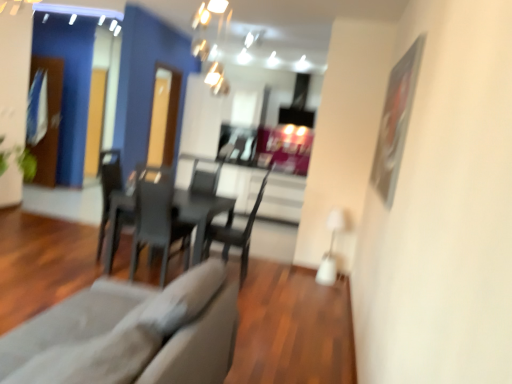
Identify the location of matte gray armchair at center, arranged as the first armchair when viewed from the left. Image resolution: width=512 pixels, height=384 pixels. (131, 204).

Where is `matte black chair at center, arranged as the 2th chair when viewed from the left`? Image resolution: width=512 pixels, height=384 pixels. matte black chair at center, arranged as the 2th chair when viewed from the left is located at coordinates (236, 234).

The width and height of the screenshot is (512, 384). What are the coordinates of `matte gray armchair at center, the second armchair positioned from the right` in the screenshot? It's located at (131, 204).

Based on their positions, is transparent glass door at center, which is counted as the 2th glass door, starting from the back, located to the left or right of gray fabric couch at lower left?

transparent glass door at center, which is counted as the 2th glass door, starting from the back, is to the left of gray fabric couch at lower left.

From the picture: From a real-world perspective, which is physically above, transparent glass door at center, marked as the first glass door in a right-to-left arrangement, or gray fabric couch at lower left?

transparent glass door at center, marked as the first glass door in a right-to-left arrangement, from a real-world perspective.

Which is closer to the camera, (156, 145) or (160, 326)?

The point (160, 326) is closer.

Which object is thinner, transparent glass door at center, positioned as the 2th glass door in left-to-right order, or gray fabric couch at lower left?

Thinner between the two is transparent glass door at center, positioned as the 2th glass door in left-to-right order.

Image resolution: width=512 pixels, height=384 pixels. Find the location of `glass door that is the 1st object located above the matte black chair at center, arranged as the 2th chair when viewed from the left (from the image's perspective)`. glass door that is the 1st object located above the matte black chair at center, arranged as the 2th chair when viewed from the left (from the image's perspective) is located at coordinates (164, 116).

Does point (177, 95) appear closer or farther from the camera than point (262, 196)?

Point (177, 95) is farther from the camera than point (262, 196).

From the image's perspective, is transparent glass door at center, arranged as the 1th glass door when viewed from the front, above or below matte black chair at center, arranged as the 1th chair when viewed from the right?

Based on their image positions, transparent glass door at center, arranged as the 1th glass door when viewed from the front, is located above matte black chair at center, arranged as the 1th chair when viewed from the right.

How different are the orientations of transparent glass door at center, which is counted as the 2th glass door, starting from the back, and matte black chair at center, arranged as the 1th chair when viewed from the right, in degrees?

The facing directions of transparent glass door at center, which is counted as the 2th glass door, starting from the back, and matte black chair at center, arranged as the 1th chair when viewed from the right, are 174 degrees apart.

Is matte black chair at center, arranged as the 1th chair when viewed from the right, inside the boundaries of transparent glass door at center, positioned as the 2th glass door in left-to-right order, or outside?

matte black chair at center, arranged as the 1th chair when viewed from the right, is not enclosed by transparent glass door at center, positioned as the 2th glass door in left-to-right order.

Could you tell me if matte black chair at center, arranged as the 2th chair when viewed from the left, is turned towards transparent glass door at center, marked as the first glass door in a right-to-left arrangement?

No, matte black chair at center, arranged as the 2th chair when viewed from the left, is not aimed at transparent glass door at center, marked as the first glass door in a right-to-left arrangement.

Is matte black chair at center, arranged as the 1th chair when viewed from the right, positioned in front of transparent glass door at center, positioned as the 2th glass door in left-to-right order?

Yes, matte black chair at center, arranged as the 1th chair when viewed from the right, is closer to the camera.

Can you confirm if matte black chair at center, arranged as the 2th chair when viewed from the left, is positioned to the right of transparent glass door at center, arranged as the 1th glass door when viewed from the front?

Correct, you'll find matte black chair at center, arranged as the 2th chair when viewed from the left, to the right of transparent glass door at center, arranged as the 1th glass door when viewed from the front.

Considering the sizes of objects metallic silver picture frame at upper right and black plastic chair at center, the first chair viewed from the left, in the image provided, who is thinner, metallic silver picture frame at upper right or black plastic chair at center, the first chair viewed from the left,?

metallic silver picture frame at upper right is thinner.

Relative to black plastic chair at center, which ranks as the 2th chair in right-to-left order, is metallic silver picture frame at upper right in front or behind?

Clearly, metallic silver picture frame at upper right is in front of black plastic chair at center, which ranks as the 2th chair in right-to-left order.

Is metallic silver picture frame at upper right situated inside black plastic chair at center, the first chair viewed from the left, or outside?

metallic silver picture frame at upper right is not enclosed by black plastic chair at center, the first chair viewed from the left.

From the image's perspective, who appears lower, metallic silver picture frame at upper right or black plastic chair at center, which ranks as the 2th chair in right-to-left order?

black plastic chair at center, which ranks as the 2th chair in right-to-left order, from the image's perspective.

Looking at this image, is gray fabric couch at lower left taller than matte black chair at center, arranged as the 1th chair when viewed from the right?

No, gray fabric couch at lower left is not taller than matte black chair at center, arranged as the 1th chair when viewed from the right.

Does gray fabric couch at lower left turn towards matte black chair at center, arranged as the 2th chair when viewed from the left?

No, gray fabric couch at lower left does not turn towards matte black chair at center, arranged as the 2th chair when viewed from the left.

Considering the relative positions of gray fabric couch at lower left and matte black chair at center, arranged as the 2th chair when viewed from the left, in the image provided, is gray fabric couch at lower left to the right of matte black chair at center, arranged as the 2th chair when viewed from the left, from the viewer's perspective?

Incorrect, gray fabric couch at lower left is not on the right side of matte black chair at center, arranged as the 2th chair when viewed from the left.

Is gray fabric couch at lower left in front of or behind matte black chair at center, arranged as the 1th chair when viewed from the right, in the image?

In the image, gray fabric couch at lower left appears in front of matte black chair at center, arranged as the 1th chair when viewed from the right.

Based on the photo, is gray fabric couch at lower left not near transparent glass door at left, the second glass door positioned from the front?

That's right, there is a large distance between gray fabric couch at lower left and transparent glass door at left, the second glass door positioned from the front.

From the image's perspective, is gray fabric couch at lower left located above transparent glass door at left, the 1th glass door when ordered from back to front?

No, from the image's perspective, gray fabric couch at lower left is not over transparent glass door at left, the 1th glass door when ordered from back to front.

Is gray fabric couch at lower left located outside transparent glass door at left, the second glass door positioned from the front?

Indeed, gray fabric couch at lower left is completely outside transparent glass door at left, the second glass door positioned from the front.

Which is more to the right, gray fabric couch at lower left or transparent glass door at left, which is the first glass door from left to right?

Positioned to the right is gray fabric couch at lower left.

From the image's perspective, between metallic silver picture frame at upper right and matte black chair at center, the second armchair positioned from the left, who is located below?

matte black chair at center, the second armchair positioned from the left, from the image's perspective.

Who is smaller, metallic silver picture frame at upper right or matte black chair at center, the second armchair positioned from the left?

Smaller between the two is metallic silver picture frame at upper right.

Where is `the 1st armchair to the left when counting from the metallic silver picture frame at upper right`? the 1st armchair to the left when counting from the metallic silver picture frame at upper right is located at coordinates (200, 197).

Is metallic silver picture frame at upper right not inside matte black chair at center, the second armchair positioned from the left?

Yes, metallic silver picture frame at upper right is outside of matte black chair at center, the second armchair positioned from the left.

Locate an element on the screen. couch on the right of transparent glass door at center, positioned as the 2th glass door in left-to-right order is located at coordinates (199, 329).

This screenshot has height=384, width=512. There is a transparent glass door at center, marked as the first glass door in a right-to-left arrangement. What are the coordinates of `the 2nd chair below it (from the image's perspective)` in the screenshot? It's located at (236, 234).

From the picture: Which object lies further to the anchor point transparent glass door at left, which ranks as the second glass door in right-to-left order, matte black chair at center, arranged as the 2th chair when viewed from the left, or matte black chair at center, the 1th armchair in the right-to-left sequence?

matte black chair at center, arranged as the 2th chair when viewed from the left, is further to transparent glass door at left, which ranks as the second glass door in right-to-left order.

Based on the photo, from the image, which object appears to be farther from matte black chair at center, arranged as the 1th chair when viewed from the right, black plastic chair at center, which ranks as the 2th chair in right-to-left order, or gray fabric couch at lower left?

gray fabric couch at lower left lies further to matte black chair at center, arranged as the 1th chair when viewed from the right, than the other object.

Based on the photo, when comparing their distances from gray fabric couch at lower left, does matte black chair at center, the 1th armchair in the right-to-left sequence, or transparent glass door at center, which is counted as the 2th glass door, starting from the back, seem further?

The object further to gray fabric couch at lower left is transparent glass door at center, which is counted as the 2th glass door, starting from the back.

Estimate the real-world distances between objects in this image. Which object is further from matte black chair at center, the 1th armchair in the right-to-left sequence, metallic silver picture frame at upper right or matte black table at center?

metallic silver picture frame at upper right.

When comparing their distances from transparent glass door at left, the second glass door positioned from the front, does metallic silver picture frame at upper right or matte black table at center seem further?

metallic silver picture frame at upper right is positioned further to the anchor transparent glass door at left, the second glass door positioned from the front.

Looking at the image, which one is located further to transparent glass door at center, marked as the first glass door in a right-to-left arrangement, matte black table at center or black plastic chair at center, the first chair viewed from the left?

black plastic chair at center, the first chair viewed from the left.

Looking at the image, which one is located closer to matte black chair at center, the 1th armchair in the right-to-left sequence, black plastic chair at center, the first chair viewed from the left, or gray fabric couch at lower left?

The object closer to matte black chair at center, the 1th armchair in the right-to-left sequence, is black plastic chair at center, the first chair viewed from the left.

When comparing their distances from matte black table at center, does matte black chair at center, arranged as the 2th chair when viewed from the left, or matte gray armchair at center, arranged as the first armchair when viewed from the left, seem closer?

matte black chair at center, arranged as the 2th chair when viewed from the left.

Where is `chair situated between matte black table at center and metallic silver picture frame at upper right from left to right`? This screenshot has width=512, height=384. chair situated between matte black table at center and metallic silver picture frame at upper right from left to right is located at coordinates coord(236,234).

The width and height of the screenshot is (512, 384). I want to click on table between gray fabric couch at lower left and transparent glass door at center, which is counted as the 2th glass door, starting from the back, in the front-back direction, so click(201, 214).

Identify the location of glass door between metallic silver picture frame at upper right and transparent glass door at left, which ranks as the second glass door in right-to-left order, in the front-back direction. (164, 116).

Locate an element on the screen. This screenshot has width=512, height=384. table situated between matte gray armchair at center, the second armchair positioned from the right, and matte black chair at center, arranged as the 1th chair when viewed from the right, from left to right is located at coordinates (201, 214).